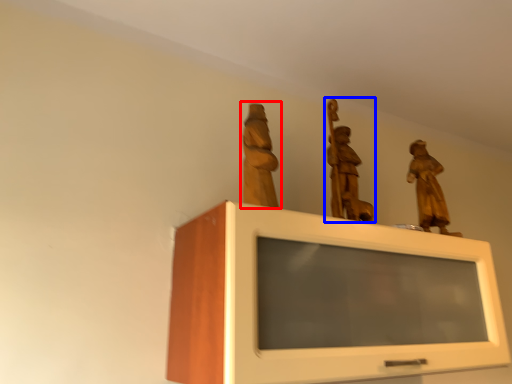
Question: Which of the following is the closest to the observer, sculpture (highlighted by a red box) or sculpture (highlighted by a blue box)?

Choices:
 (A) sculpture
 (B) sculpture

Answer: (A)